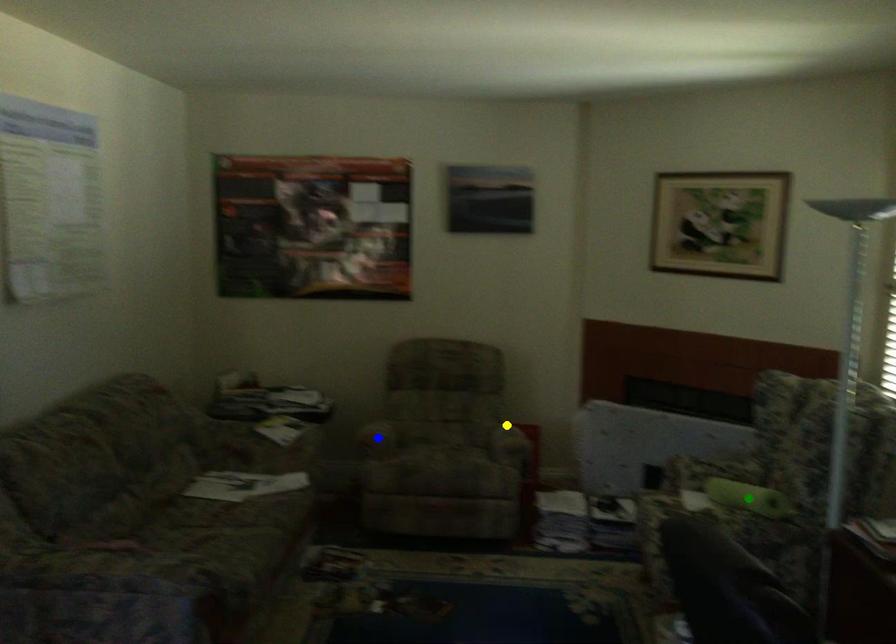
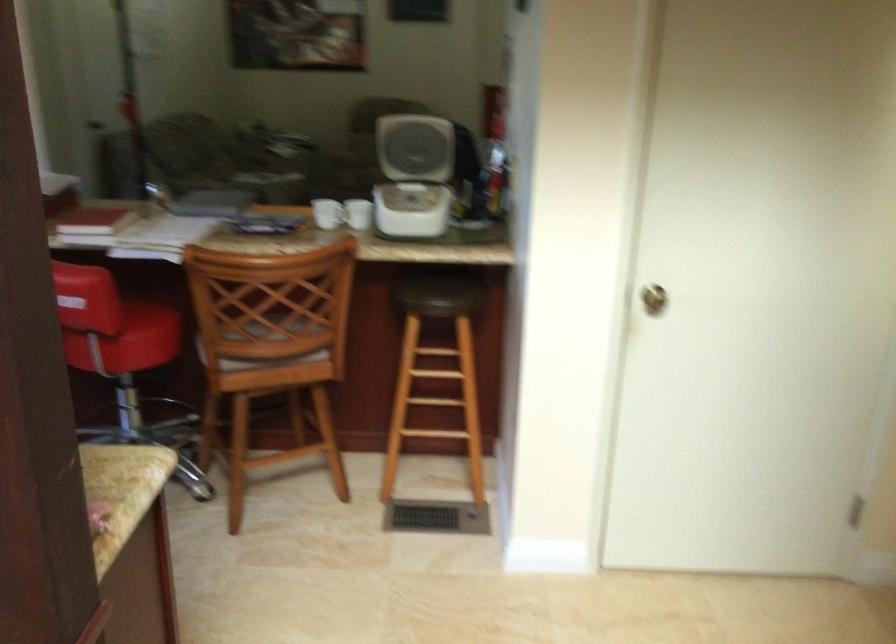
I am providing you with two images of the same scene from different viewpoints. Three points are marked in image1. Which point corresponds to a part or object that is occluded in image2?In image1, three points are marked. Which of them correspond to a part or object that is occluded in image2?Among the three points shown in image1, which one corresponds to a part or object that is no longer visible due to occlusion in image2?

blue point, green point, yellow point cannot be seen in image2.